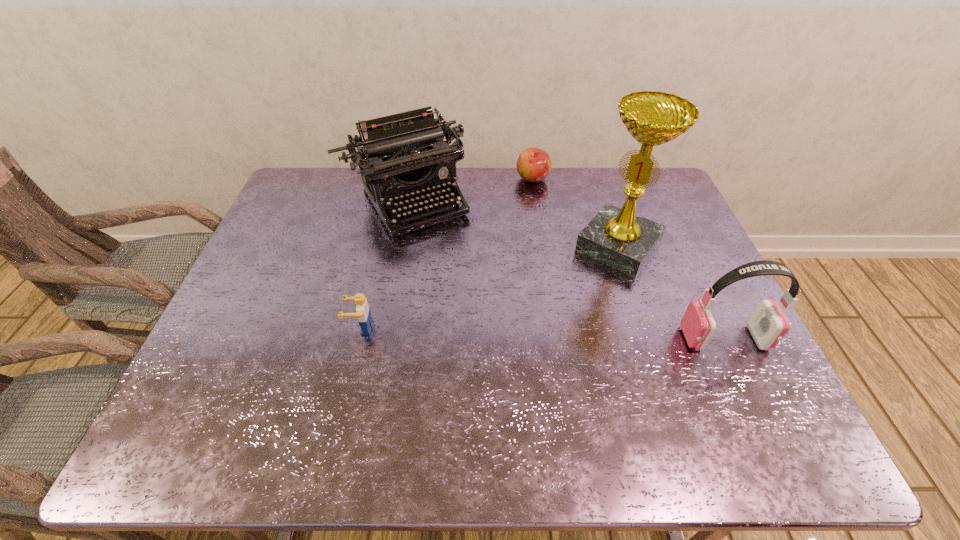
Identify the location of free spot between the typewriter and the award. The image size is (960, 540). (512, 224).

The width and height of the screenshot is (960, 540). I want to click on vacant space that's between the earphone and the typewriter, so click(x=564, y=269).

Find the location of `vacant area that lies between the Lego and the award`. vacant area that lies between the Lego and the award is located at coordinates (490, 287).

The width and height of the screenshot is (960, 540). Identify the location of free space that is in between the earphone and the typewriter. (564, 269).

You are a GUI agent. You are given a task and a screenshot of the screen. Output one action in this format:
    pyautogui.click(x=<x>, y=<y>)
    Task: Click on the empty space between the tallest object and the typewriter
    
    Given the screenshot: What is the action you would take?
    pyautogui.click(x=512, y=224)

What are the coordinates of `blank region between the third object from right to left and the Lego` in the screenshot? It's located at (x=446, y=253).

Image resolution: width=960 pixels, height=540 pixels. Identify the location of vacant area between the Lego and the apple. (446, 253).

Identify which object is the second nearest to the tallest object. Please provide its 2D coordinates. Your answer should be formatted as a tuple, i.e. [(x, y)], where the tuple contains the x and y coordinates of a point satisfying the conditions above.

[(534, 164)]

What are the coordinates of `object that stands as the second closest to the Lego` in the screenshot? It's located at (617, 237).